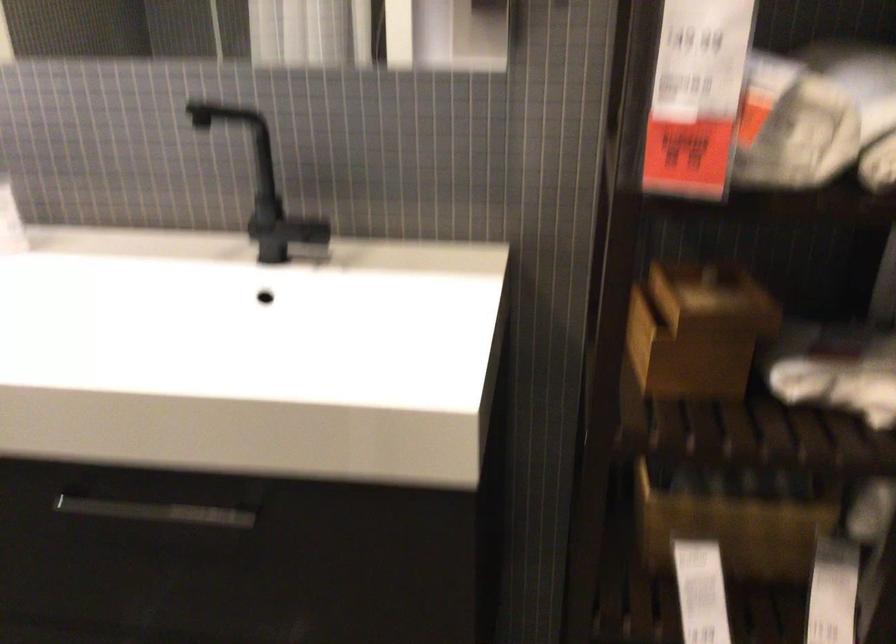
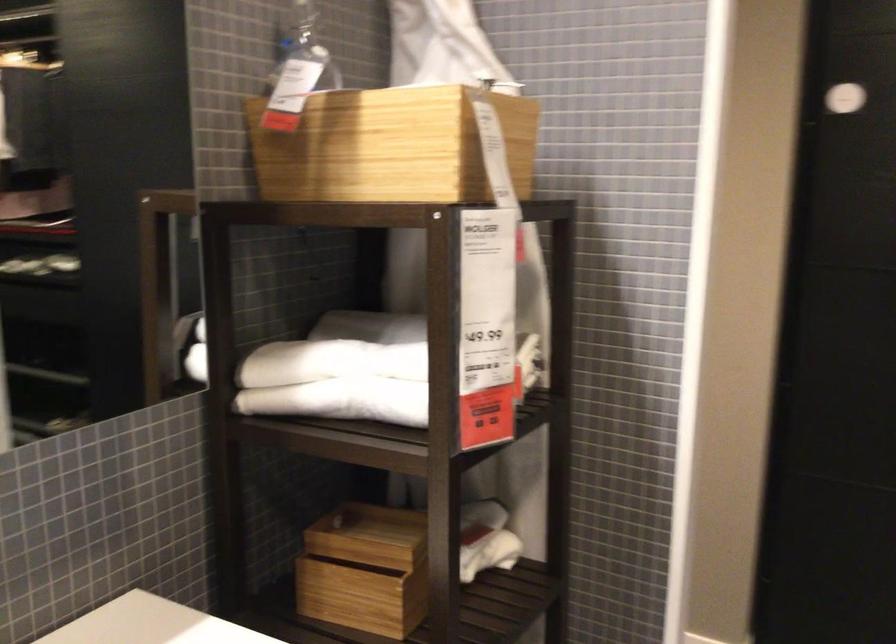
Where in the second image is the point corresponding to (x=673, y=71) from the first image?

(330, 362)